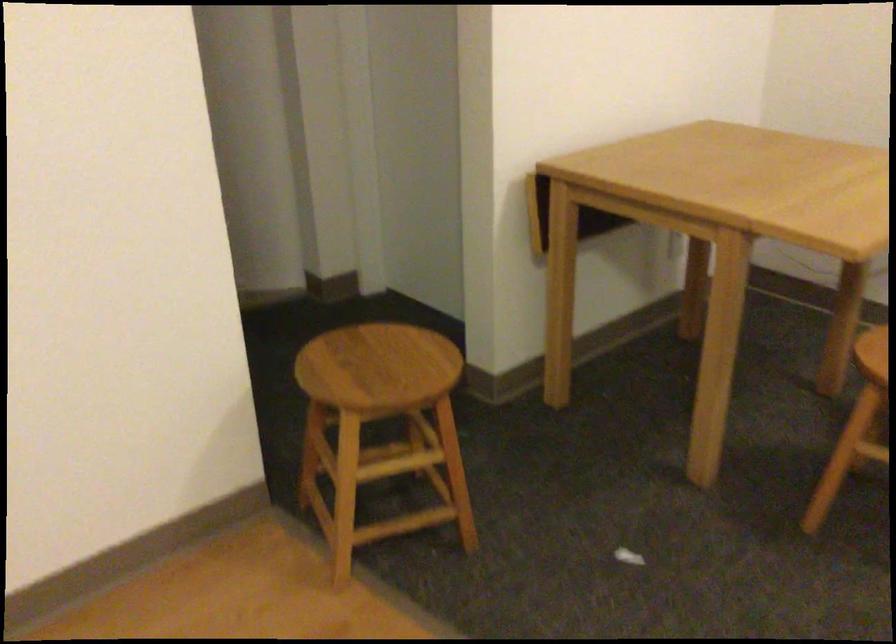
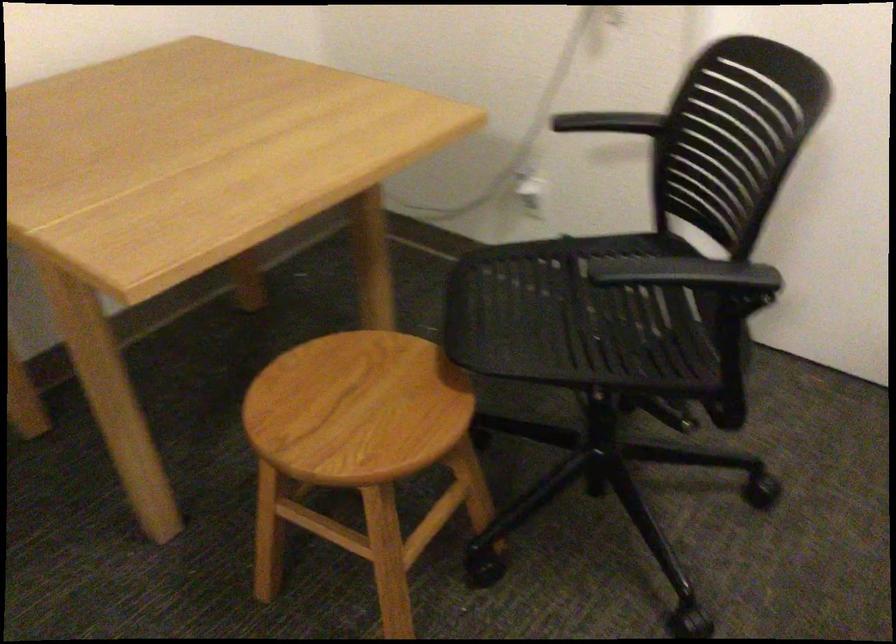
What movement of the cameraman would produce the second image?

The cameraman moved toward right, forward.